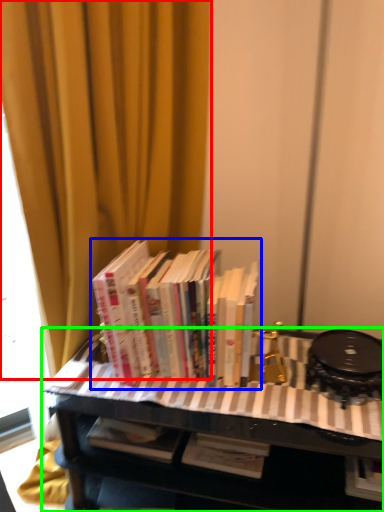
Question: Which object is positioned farthest from curtain (highlighted by a red box)? Select from book (highlighted by a blue box) and table (highlighted by a green box).

Choices:
 (A) book
 (B) table

Answer: (B)